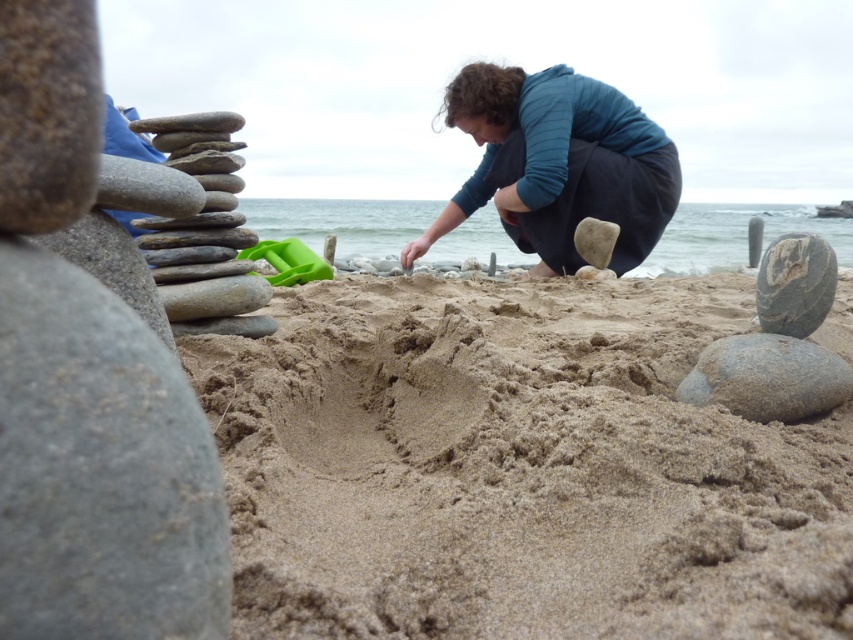
Between point (689, 545) and point (839, 372), which one is positioned in front?

Positioned in front is point (689, 545).

Who is more forward, (618,352) or (804,385)?

Positioned in front is point (804,385).

Where is `fine-grained sand at center`? Image resolution: width=853 pixels, height=640 pixels. fine-grained sand at center is located at coordinates (517, 467).

Is dark blue fabric at center wider than smooth gray rock at right?

Yes, dark blue fabric at center is wider than smooth gray rock at right.

What do you see at coordinates (558, 164) in the screenshot?
I see `dark blue fabric at center` at bounding box center [558, 164].

At what (x,y) coordinates should I click in order to perform the action: click on dark blue fabric at center. Please return your answer as a coordinate pair (x, y). This screenshot has width=853, height=640. Looking at the image, I should click on (558, 164).

Looking at this image, which is more to the right, smooth gray stones at left or smooth gray rock at right?

smooth gray rock at right is more to the right.

Who is more forward, (233, 212) or (805, 333)?

Point (805, 333)

This screenshot has height=640, width=853. Find the location of `smooth gray stones at left`. smooth gray stones at left is located at coordinates (204, 230).